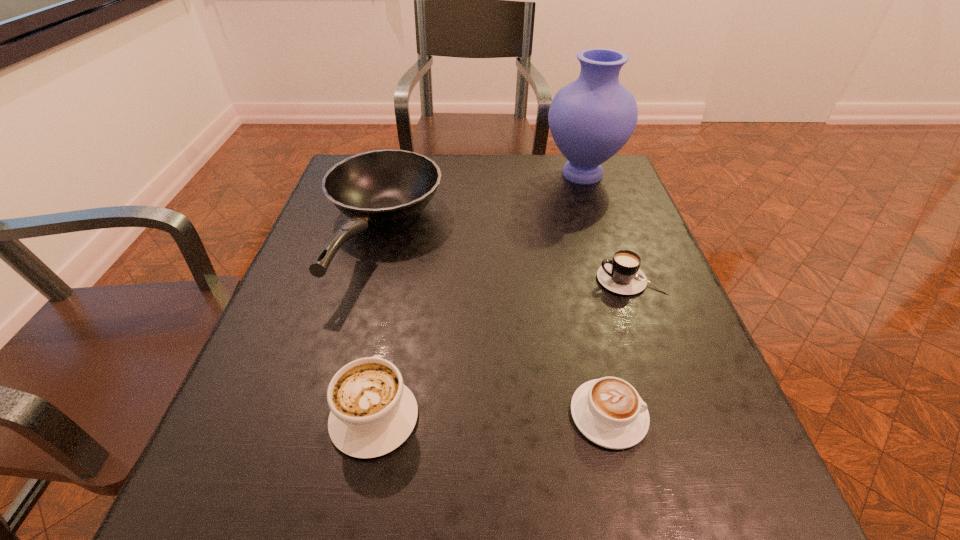
Image resolution: width=960 pixels, height=540 pixels. In order to click on free space located 0.390m with the handle on the side of the farthest cappuccino in this screenshot , I will do `click(410, 280)`.

Locate an element on the screen. free space located 0.380m with the handle on the side of the farthest cappuccino is located at coordinates (415, 280).

I want to click on vacant space located with the handle on the side of the farthest cappuccino, so click(544, 280).

This screenshot has width=960, height=540. Identify the location of vase that is at the far edge. (590, 119).

This screenshot has width=960, height=540. What are the coordinates of `frying pan located at the far edge` in the screenshot? It's located at (387, 187).

Locate an element on the screen. frying pan that is at the left edge is located at coordinates (387, 187).

Find the location of `cappuccino that is at the left edge`. cappuccino that is at the left edge is located at coordinates (372, 412).

You are a GUI agent. You are given a task and a screenshot of the screen. Output one action in this format:
    pyautogui.click(x=<x>, y=<y>)
    Task: Click on the vase that is at the right edge
    The width and height of the screenshot is (960, 540).
    Given the screenshot: What is the action you would take?
    pyautogui.click(x=590, y=119)

Locate an element on the screen. object that is at the far left corner is located at coordinates coord(387,187).

Locate an element on the screen. The height and width of the screenshot is (540, 960). object located at the far right corner is located at coordinates (590, 119).